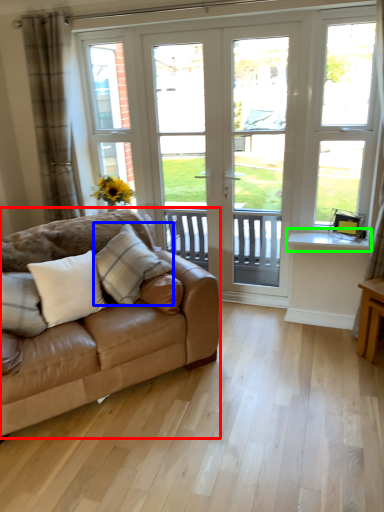
Question: Considering the real-world distances, which object is closest to studio couch (highlighted by a red box)? pillow (highlighted by a blue box) or window sill (highlighted by a green box).

Choices:
 (A) pillow
 (B) window sill

Answer: (A)